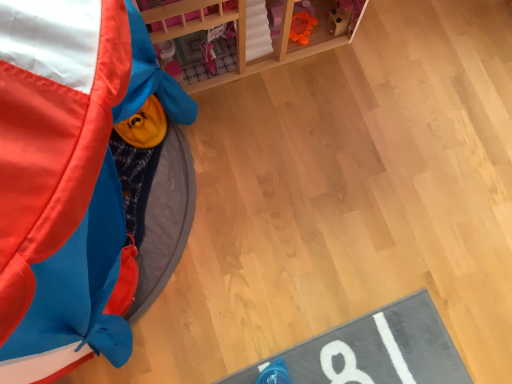
Locate an element on the screen. The image size is (512, 384). vacant space to the right of rubberized yellow toy at upper left is located at coordinates (324, 230).